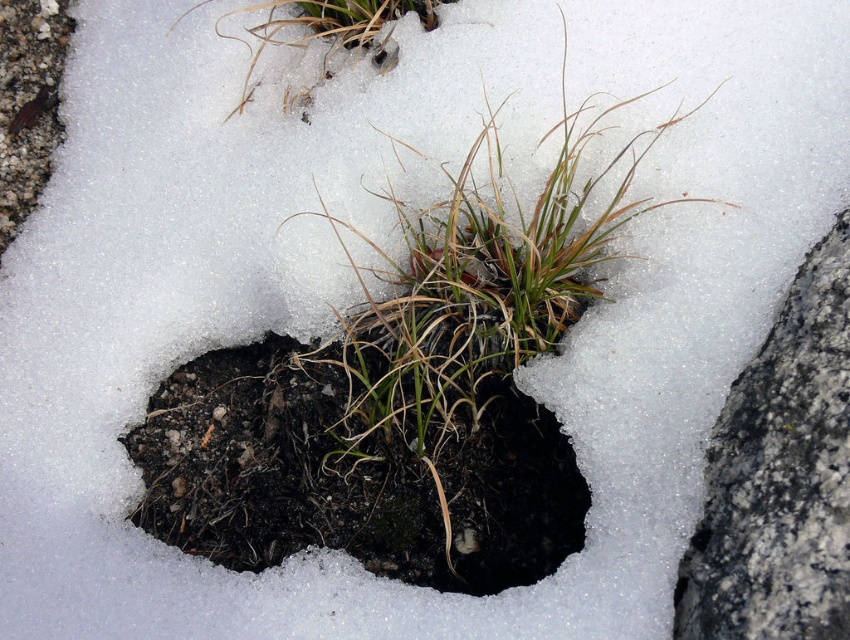
Question: Is dull brown soil at center positioned at the back of gray rough rock at right?

Choices:
 (A) yes
 (B) no

Answer: (A)

Question: Which object is positioned farthest from the dry grass at upper center?

Choices:
 (A) dull brown soil at center
 (B) gray rough rock at right

Answer: (B)

Question: Which of the following is the farthest from the observer?

Choices:
 (A) dull brown soil at center
 (B) green grass at center

Answer: (A)

Question: Estimate the real-world distances between objects in this image. Which object is farther from the green grass at center?

Choices:
 (A) dry grass at upper center
 (B) gray rough rock at right

Answer: (B)

Question: Can you confirm if dull brown soil at center is bigger than green grass at center?

Choices:
 (A) yes
 (B) no

Answer: (B)

Question: Can you confirm if green grass at center is positioned above gray rough rock at right?

Choices:
 (A) yes
 (B) no

Answer: (A)